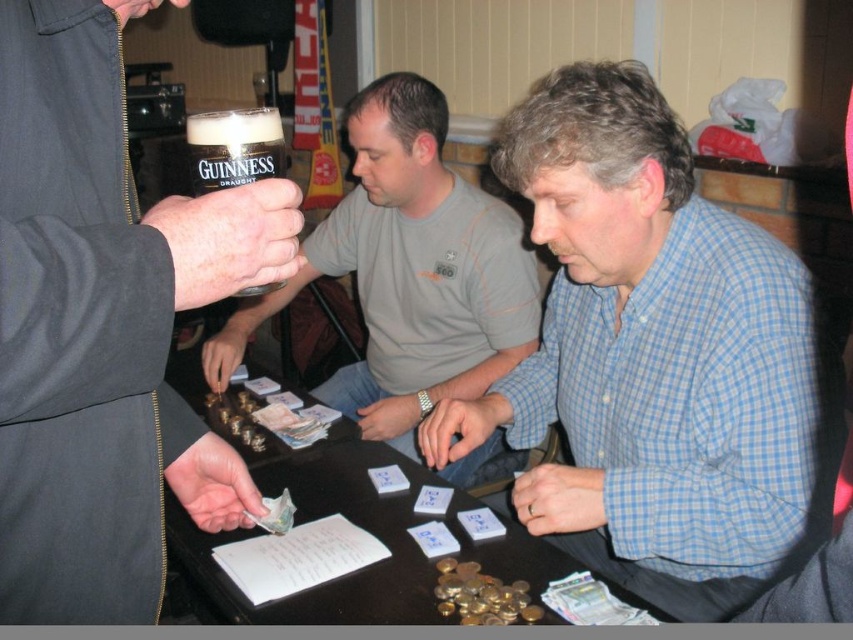
Question: Among these points, which one is farthest from the camera?

Choices:
 (A) (395, 516)
 (B) (647, 381)
 (C) (44, 292)
 (D) (218, 113)

Answer: (A)

Question: Is blue checkered shirt at center below matte black glass at left?

Choices:
 (A) no
 (B) yes

Answer: (B)

Question: Which object is closer to the camera taking this photo?

Choices:
 (A) matte black glass at left
 (B) blue checkered shirt at center
 (C) matte black glass at center
 (D) guinness glass at upper left

Answer: (A)

Question: Which object appears farthest from the camera in this image?

Choices:
 (A) wooden table at center
 (B) blue checkered shirt at center
 (C) guinness glass at upper left

Answer: (B)

Question: Does matte black glass at left lie in front of matte black glass at center?

Choices:
 (A) no
 (B) yes

Answer: (B)

Question: Does matte black glass at center have a lesser width compared to guinness glass at upper left?

Choices:
 (A) yes
 (B) no

Answer: (B)